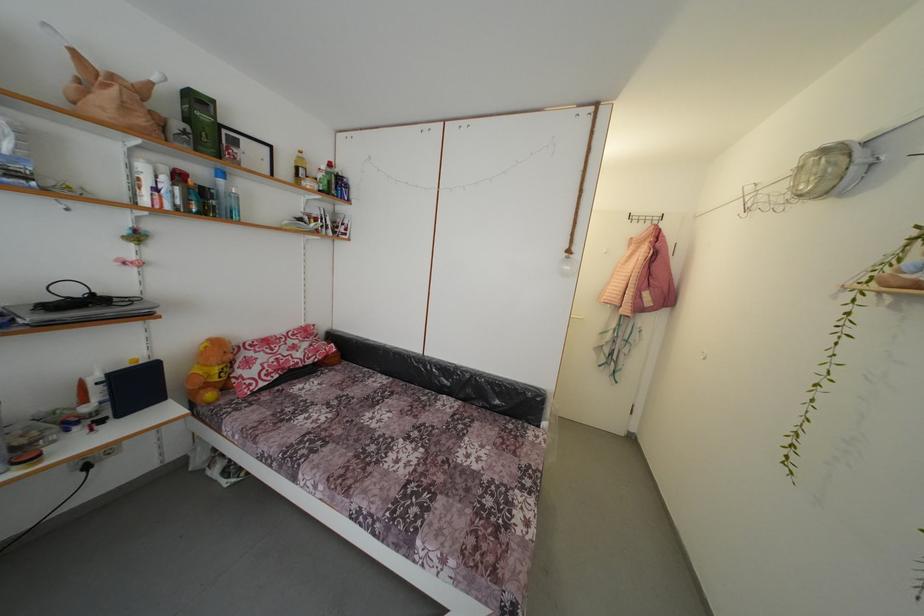
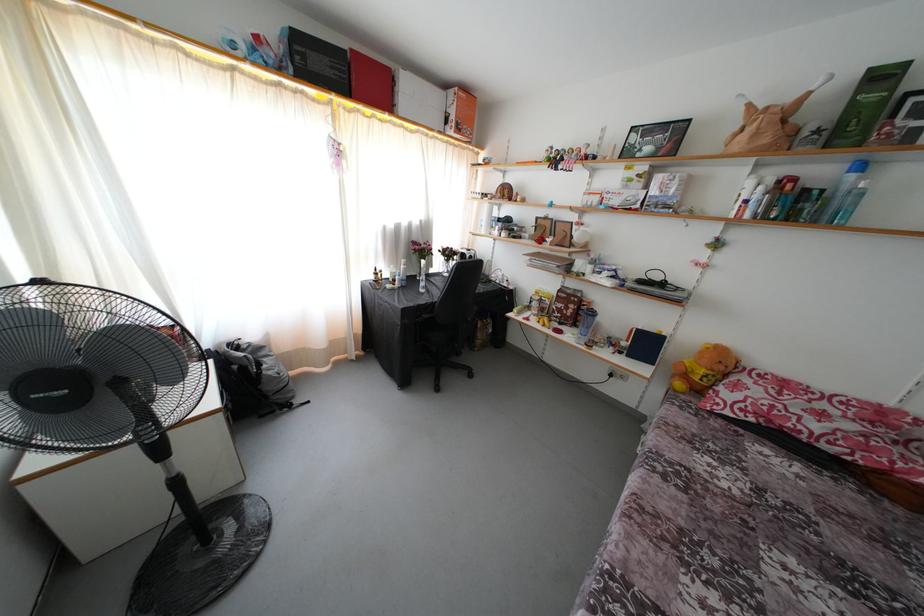
Find the pixel in the second image that matches (x=216, y=177) in the first image.

(849, 172)